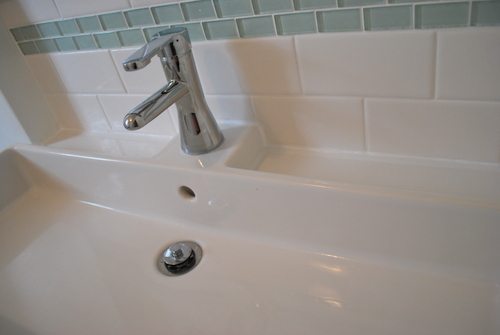
You are a GUI agent. You are given a task and a screenshot of the screen. Output one action in this format:
    pyautogui.click(x=<x>, y=<y>)
    Task: Click on the bottom of faucet
    
    Given the screenshot: What is the action you would take?
    pyautogui.click(x=181, y=149), pyautogui.click(x=223, y=135)